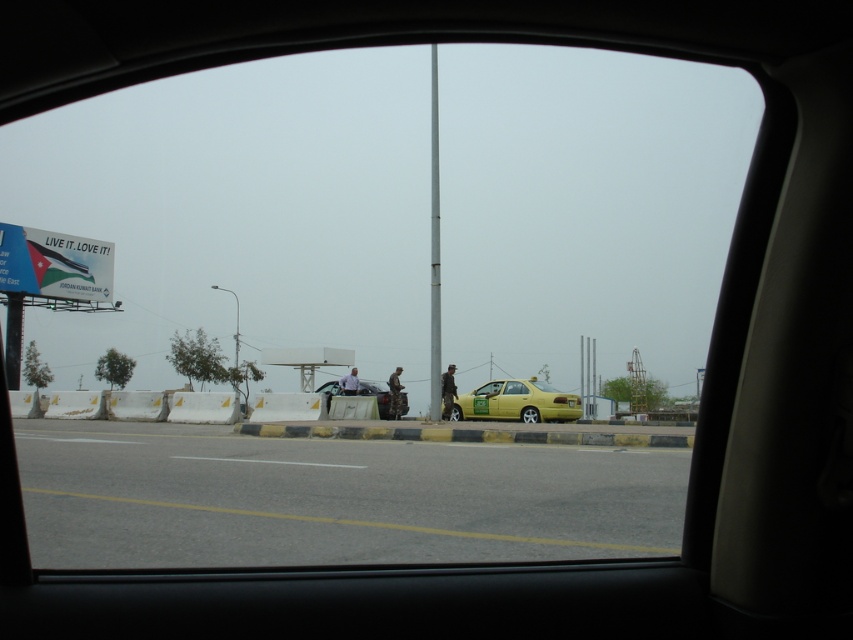
Question: Estimate the real-world distances between objects in this image. Which object is farther from the camouflage fabric jacket at center?

Choices:
 (A) yellow matte taxi at center
 (B) metallic silver car at center

Answer: (A)

Question: Among these points, which one is nearest to the camera?

Choices:
 (A) (397, 410)
 (B) (354, 380)

Answer: (A)

Question: Does metallic pole at center appear under camouflage fabric jacket at center?

Choices:
 (A) no
 (B) yes

Answer: (A)

Question: Can you confirm if yellow matte taxi at center is positioned to the left of metallic pole at center?

Choices:
 (A) no
 (B) yes

Answer: (A)

Question: Considering the relative positions of metallic pole at center and metallic silver car at center in the image provided, where is metallic pole at center located with respect to metallic silver car at center?

Choices:
 (A) right
 (B) left

Answer: (A)

Question: Which is farther from the dark brown leather jacket at center?

Choices:
 (A) yellow matte taxi at center
 (B) camouflage fabric jacket at center
 (C) light blue shirt at center
 (D) metallic pole at center

Answer: (D)